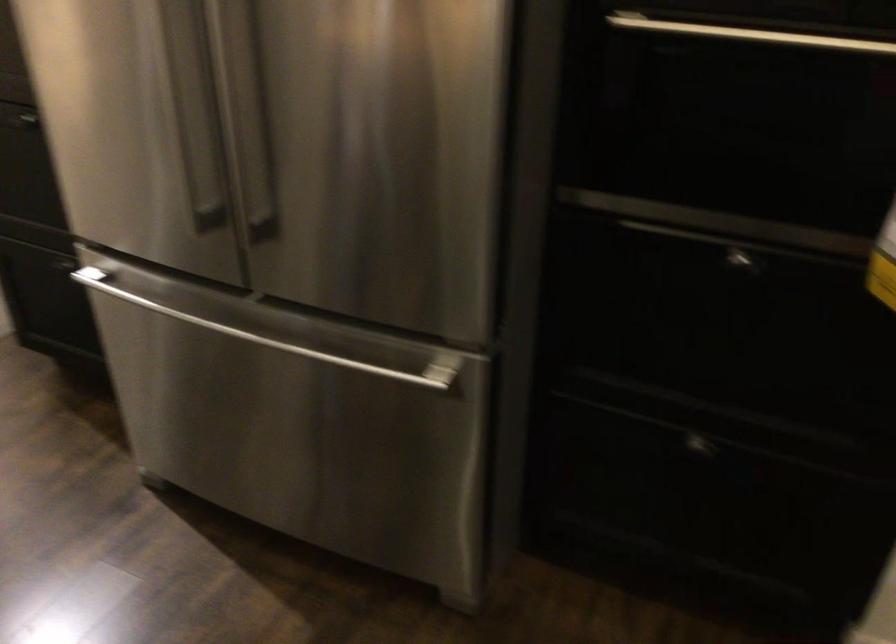
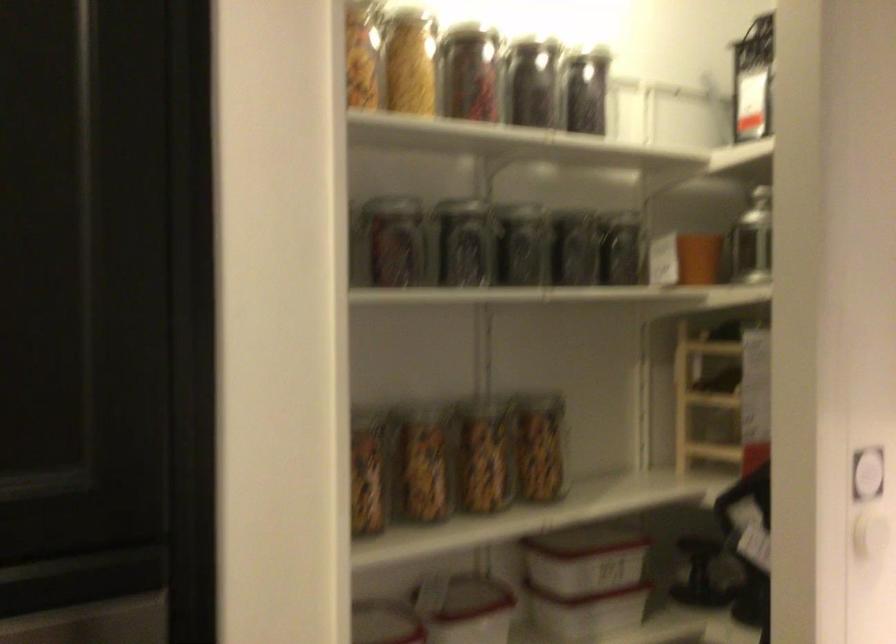
Question: The images are taken continuously from a first-person perspective. In which direction is your viewpoint rotating?

Choices:
 (A) Left
 (B) Right
 (C) Up
 (D) Down

Answer: (B)